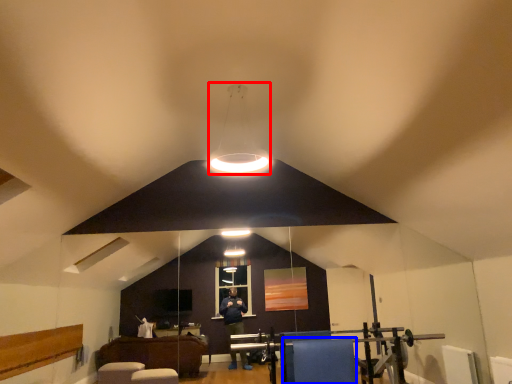
Question: Which point is further to the camera, lamp (highlighted by a red box) or furniture (highlighted by a blue box)?

Choices:
 (A) lamp
 (B) furniture

Answer: (B)